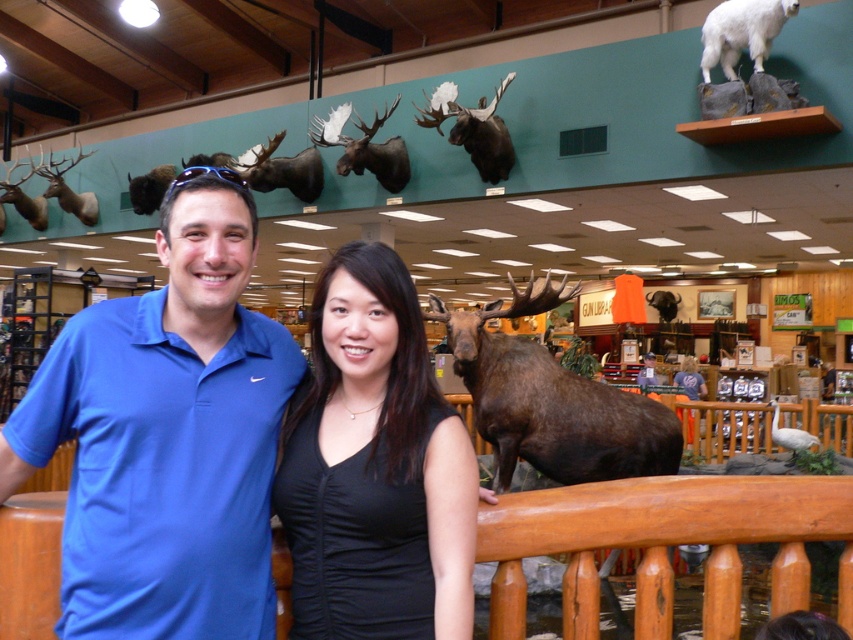
Is shiny brown moose head at upper center in front of white feathered bird at upper right?

That is False.

Between point (294, 172) and point (793, 440), which one is positioned in front?

Point (793, 440) is more forward.

The height and width of the screenshot is (640, 853). In order to click on shiny brown moose head at upper center in this screenshot , I will do `click(283, 170)`.

Looking at this image, can you confirm if brown matte moose at center is thinner than white feathered bird at upper right?

No.

Which is more to the left, brown matte moose at center or white feathered bird at upper right?

Positioned to the left is brown matte moose at center.

Between point (451, 348) and point (780, 444), which one is positioned in front?

Positioned in front is point (451, 348).

You are a GUI agent. You are given a task and a screenshot of the screen. Output one action in this format:
    pyautogui.click(x=<x>, y=<y>)
    Task: Click on the brown matte moose at center
    This screenshot has width=853, height=640.
    Given the screenshot: What is the action you would take?
    pyautogui.click(x=550, y=403)

Does black matte dress at center appear on the right side of white feathered bird at upper right?

No, black matte dress at center is not to the right of white feathered bird at upper right.

Is black matte dress at center shorter than white feathered bird at upper right?

No.

Measure the distance between point (369, 611) and camera.

The distance of point (369, 611) from camera is 5.05 feet.

Where is `black matte dress at center`? The image size is (853, 640). black matte dress at center is located at coordinates (369, 461).